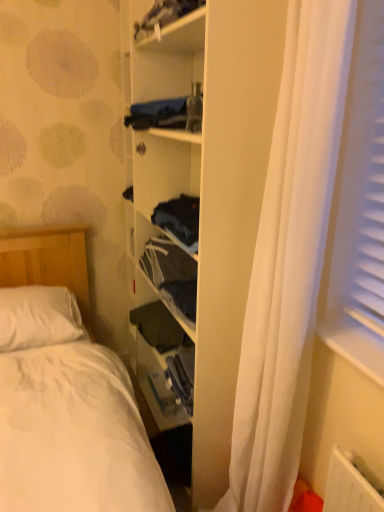
Identify the location of wooden bookshelf at center. This screenshot has width=384, height=512. (209, 186).

What do you see at coordinates (289, 258) in the screenshot? The image size is (384, 512). I see `white fabric curtain at center` at bounding box center [289, 258].

This screenshot has width=384, height=512. I want to click on white soft pillow at left, so click(x=38, y=317).

Is white fabric curtain at center wider than white soft pillow at left?

Yes.

Is white fabric curtain at center not near white soft pillow at left?

Yes, white fabric curtain at center and white soft pillow at left are located far from each other.

Is white fabric curtain at center outside of white soft pillow at left?

Yes, white fabric curtain at center is outside of white soft pillow at left.

Between white fabric curtain at center and white soft pillow at left, which one has less height?

white soft pillow at left is shorter.

From the image's perspective, would you say white soft pillow at left is positioned over wooden bookshelf at center?

No, from the image's perspective, white soft pillow at left is not over wooden bookshelf at center.

From a real-world perspective, between white soft pillow at left and wooden bookshelf at center, who is vertically lower?

white soft pillow at left, from a real-world perspective.

Considering the relative positions of white soft pillow at left and wooden bookshelf at center in the image provided, is white soft pillow at left to the left or to the right of wooden bookshelf at center?

Clearly, white soft pillow at left is on the left of wooden bookshelf at center in the image.

Considering the positions of points (46, 328) and (267, 161), is point (46, 328) farther from camera compared to point (267, 161)?

Yes.

Which of these two, dark blue fabric at upper center or wooden bookshelf at center, is wider?

wooden bookshelf at center is wider.

From the image's perspective, is dark blue fabric at upper center on wooden bookshelf at center?

Correct, dark blue fabric at upper center appears higher than wooden bookshelf at center in the image.

Is dark blue fabric at upper center looking in the opposite direction of wooden bookshelf at center?

Yes, dark blue fabric at upper center's orientation is away from wooden bookshelf at center.

From the picture: Is dark blue fabric at upper center spatially inside wooden bookshelf at center, or outside of it?

dark blue fabric at upper center is located inside wooden bookshelf at center.

Could you tell me if dark blue fabric at upper center is turned towards white fabric curtain at center?

No, dark blue fabric at upper center is not facing towards white fabric curtain at center.

Which is less distant, (188, 0) or (281, 105)?

Point (188, 0).

This screenshot has width=384, height=512. In order to click on curtain directly beneath the dark blue fabric at upper center (from a real-world perspective) in this screenshot , I will do `click(289, 258)`.

Does point (195, 9) lie behind point (0, 295)?

No.

Is dark blue fabric at upper center inside or outside of white soft pillow at left?

dark blue fabric at upper center is not enclosed by white soft pillow at left.

In terms of height, does dark blue fabric at upper center look taller or shorter compared to white soft pillow at left?

dark blue fabric at upper center is shorter than white soft pillow at left.

From a real-world perspective, which is physically above, dark blue fabric at upper center or white soft pillow at left?

In real-world perspective, dark blue fabric at upper center is above.

Does wooden bookshelf at center have a lesser height compared to dark blue fabric at upper center?

In fact, wooden bookshelf at center may be taller than dark blue fabric at upper center.

Identify the location of clothing that appears above the wooden bookshelf at center (from a real-world perspective). This screenshot has width=384, height=512. (165, 14).

Can you confirm if wooden bookshelf at center is positioned to the left of dark blue fabric at upper center?

Incorrect, wooden bookshelf at center is not on the left side of dark blue fabric at upper center.

Between point (206, 458) and point (151, 21), which one is positioned in front?

Point (206, 458)

Is white fabric curtain at center placed right next to dark blue fabric at upper center?

No, white fabric curtain at center is not making contact with dark blue fabric at upper center.

Considering the sizes of objects white fabric curtain at center and dark blue fabric at upper center in the image provided, who is bigger, white fabric curtain at center or dark blue fabric at upper center?

Bigger between the two is white fabric curtain at center.

The width and height of the screenshot is (384, 512). I want to click on pillow below the white fabric curtain at center (from the image's perspective), so click(38, 317).

Identify the location of bookshelf above the white soft pillow at left (from the image's perspective). (209, 186).

Estimate the real-world distances between objects in this image. Which object is further from white soft pillow at left, dark blue fabric at upper center or white fabric curtain at center?

dark blue fabric at upper center is positioned further to the anchor white soft pillow at left.

Which object lies further to the anchor point wooden bookshelf at center, white fabric curtain at center or white soft pillow at left?

white soft pillow at left.

Considering their positions, is wooden bookshelf at center positioned further to white soft pillow at left than dark blue fabric at upper center?

Based on the image, dark blue fabric at upper center appears to be further to white soft pillow at left.

From the image, which object appears to be farther from white soft pillow at left, dark blue fabric at upper center or wooden bookshelf at center?

dark blue fabric at upper center is further to white soft pillow at left.

In the scene shown: When comparing their distances from dark blue fabric at upper center, does white soft pillow at left or white fabric curtain at center seem closer?

Based on the image, white fabric curtain at center appears to be nearer to dark blue fabric at upper center.

When comparing their distances from wooden bookshelf at center, does white fabric curtain at center or dark blue fabric at upper center seem further?

Based on the image, dark blue fabric at upper center appears to be further to wooden bookshelf at center.

Consider the image. Looking at the image, which one is located further to white fabric curtain at center, dark blue fabric at upper center or white soft pillow at left?

white soft pillow at left is positioned further to the anchor white fabric curtain at center.

Estimate the real-world distances between objects in this image. Which object is further from wooden bookshelf at center, dark blue fabric at upper center or white fabric curtain at center?

The object further to wooden bookshelf at center is dark blue fabric at upper center.

The image size is (384, 512). In order to click on bookshelf between dark blue fabric at upper center and white fabric curtain at center vertically in this screenshot , I will do `click(209, 186)`.

This screenshot has width=384, height=512. Identify the location of bookshelf located between white fabric curtain at center and white soft pillow at left in the depth direction. (209, 186).

Locate an element on the screen. bookshelf between dark blue fabric at upper center and white soft pillow at left vertically is located at coordinates (209, 186).

Identify the location of curtain between dark blue fabric at upper center and white soft pillow at left vertically. click(289, 258).